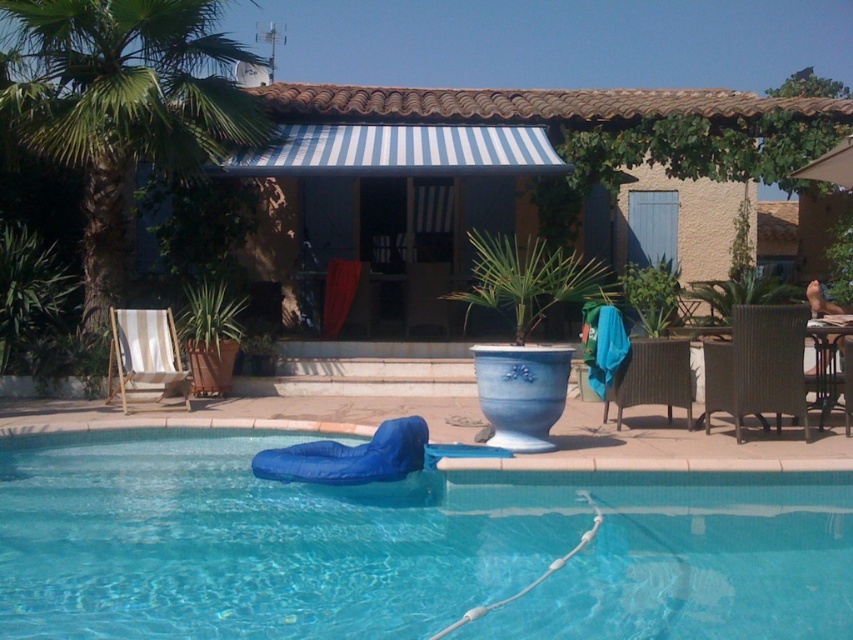
Question: Can you confirm if beige striped beach chair at left is positioned below brown wicker chair at lower right?

Choices:
 (A) no
 (B) yes

Answer: (A)

Question: From the image, what is the correct spatial relationship of brown woven chair at right in relation to beige striped beach chair at left?

Choices:
 (A) right
 (B) left

Answer: (A)

Question: Which object appears closest to the camera in this image?

Choices:
 (A) brown woven chair at right
 (B) beige striped beach chair at left

Answer: (A)

Question: Which point appears closest to the camera in this image?

Choices:
 (A) (201, 67)
 (B) (352, 493)
 (C) (146, 349)
 (D) (802, 412)

Answer: (B)

Question: Which point is closer to the camera?

Choices:
 (A) blue fabric at lower center
 (B) brown woven chair at right
 (C) brown wicker chair at lower right
 (D) green leafy palm tree at left

Answer: (A)

Question: Can you confirm if blue fabric at lower center is thinner than beige striped beach chair at left?

Choices:
 (A) no
 (B) yes

Answer: (A)